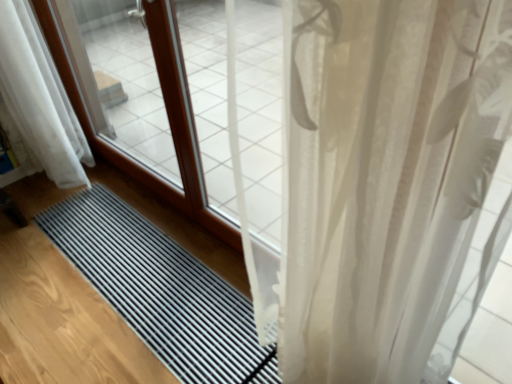
Find the location of `vacant space underneath black rubber mat at center (from a real-world perspective)`. vacant space underneath black rubber mat at center (from a real-world perspective) is located at coordinates (158, 275).